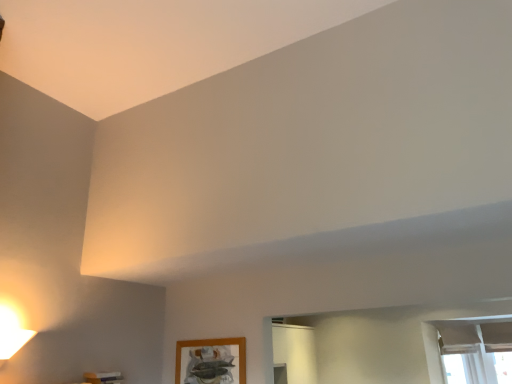
Describe the element at coordinates (211, 360) in the screenshot. The image size is (512, 384). I see `wooden picture frame at lower center` at that location.

Describe the element at coordinates (103, 377) in the screenshot. The width and height of the screenshot is (512, 384). I see `matte white remote at lower left` at that location.

What do you see at coordinates (467, 348) in the screenshot? The image size is (512, 384). I see `white sheer curtain at lower right` at bounding box center [467, 348].

Image resolution: width=512 pixels, height=384 pixels. Identify the location of wooden picture frame at lower center. (211, 360).

Which object is positioned more to the left, wooden picture frame at lower center or matte white remote at lower left?

matte white remote at lower left.

Is wooden picture frame at lower center located outside matte white remote at lower left?

Absolutely, wooden picture frame at lower center is external to matte white remote at lower left.

How far apart are wooden picture frame at lower center and matte white remote at lower left?

A distance of 66.64 centimeters exists between wooden picture frame at lower center and matte white remote at lower left.

Considering the positions of objects wooden picture frame at lower center and matte white remote at lower left in the image provided, who is in front, wooden picture frame at lower center or matte white remote at lower left?

matte white remote at lower left.

The width and height of the screenshot is (512, 384). I want to click on picture frame in front of the white sheer curtain at lower right, so click(x=211, y=360).

Considering the relative sizes of wooden picture frame at lower center and white sheer curtain at lower right in the image provided, is wooden picture frame at lower center bigger than white sheer curtain at lower right?

Incorrect, wooden picture frame at lower center is not larger than white sheer curtain at lower right.

Which object is further away from the camera taking this photo, matte white remote at lower left or wooden picture frame at lower center?

wooden picture frame at lower center is further from the camera.

Which object is wider, matte white remote at lower left or wooden picture frame at lower center?

matte white remote at lower left.

Can you confirm if matte white remote at lower left is shorter than wooden picture frame at lower center?

Yes.

From the image's perspective, is matte white remote at lower left below wooden picture frame at lower center?

No, from the image's perspective, matte white remote at lower left is not beneath wooden picture frame at lower center.

Based on the photo, between white sheer curtain at lower right and wooden picture frame at lower center, which one has larger size?

white sheer curtain at lower right.

From a real-world perspective, which is physically below, white sheer curtain at lower right or wooden picture frame at lower center?

In real-world perspective, white sheer curtain at lower right is lower.

Considering the sizes of objects white sheer curtain at lower right and wooden picture frame at lower center in the image provided, who is shorter, white sheer curtain at lower right or wooden picture frame at lower center?

wooden picture frame at lower center is shorter.

Does point (445, 320) appear closer or farther from the camera than point (220, 370)?

Clearly, point (445, 320) is more distant from the camera than point (220, 370).

Locate an element on the screen. furniture located in front of the white sheer curtain at lower right is located at coordinates (103, 377).

What's the angular difference between white sheer curtain at lower right and matte white remote at lower left's facing directions?

The angular difference between white sheer curtain at lower right and matte white remote at lower left is 46.3 degrees.

Considering the positions of objects white sheer curtain at lower right and matte white remote at lower left in the image provided, who is more to the left, white sheer curtain at lower right or matte white remote at lower left?

matte white remote at lower left is more to the left.

Considering the relative sizes of white sheer curtain at lower right and matte white remote at lower left in the image provided, is white sheer curtain at lower right wider than matte white remote at lower left?

Yes.

Consider the image. Considering the sizes of matte white remote at lower left and white sheer curtain at lower right in the image, is matte white remote at lower left wider or thinner than white sheer curtain at lower right?

Considering their sizes, matte white remote at lower left looks slimmer than white sheer curtain at lower right.

Is matte white remote at lower left in contact with white sheer curtain at lower right?

matte white remote at lower left and white sheer curtain at lower right are not in contact.

The width and height of the screenshot is (512, 384). I want to click on window above the matte white remote at lower left (from a real-world perspective), so (467, 348).

From a real-world perspective, is matte white remote at lower left beneath white sheer curtain at lower right?

Yes.

The image size is (512, 384). I want to click on picture frame above the matte white remote at lower left (from a real-world perspective), so click(211, 360).

Where is `picture frame in front of the white sheer curtain at lower right`? This screenshot has width=512, height=384. picture frame in front of the white sheer curtain at lower right is located at coordinates (211, 360).

Which object lies further to the anchor point white sheer curtain at lower right, wooden picture frame at lower center or matte white remote at lower left?

Based on the image, matte white remote at lower left appears to be further to white sheer curtain at lower right.

Based on their spatial positions, is matte white remote at lower left or wooden picture frame at lower center further from white sheer curtain at lower right?

matte white remote at lower left.

From the image, which object appears to be nearer to wooden picture frame at lower center, white sheer curtain at lower right or matte white remote at lower left?

Among the two, matte white remote at lower left is located nearer to wooden picture frame at lower center.

Which object lies nearer to the anchor point wooden picture frame at lower center, matte white remote at lower left or white sheer curtain at lower right?

matte white remote at lower left is closer to wooden picture frame at lower center.

Consider the image. From the image, which object appears to be farther from matte white remote at lower left, white sheer curtain at lower right or wooden picture frame at lower center?

white sheer curtain at lower right is further to matte white remote at lower left.

From the image, which object appears to be nearer to matte white remote at lower left, wooden picture frame at lower center or white sheer curtain at lower right?

Based on the image, wooden picture frame at lower center appears to be nearer to matte white remote at lower left.

Image resolution: width=512 pixels, height=384 pixels. Find the location of `picture frame between matte white remote at lower left and white sheer curtain at lower right from left to right`. picture frame between matte white remote at lower left and white sheer curtain at lower right from left to right is located at coordinates coord(211,360).